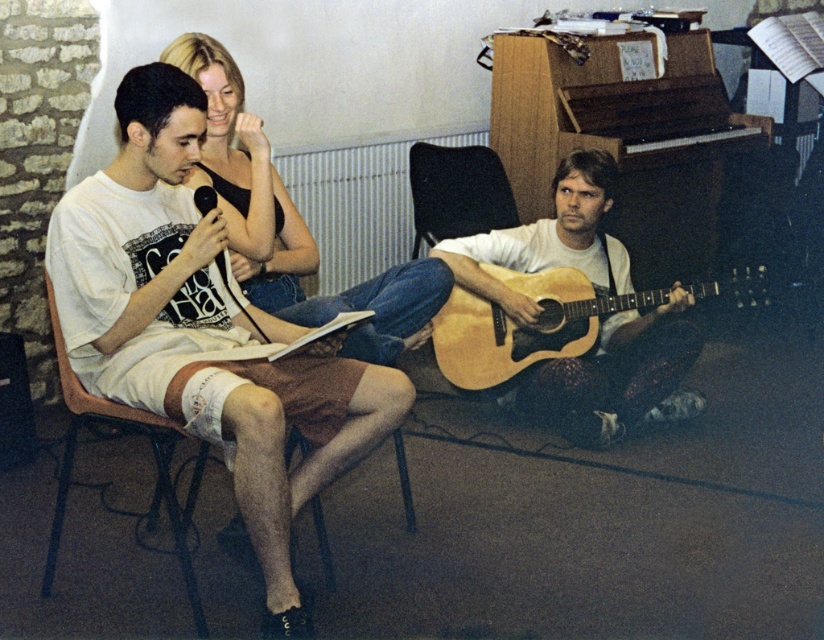
Measure the distance between point (235,310) and camera.

The distance of point (235,310) from camera is 8.58 feet.

Who is higher up, white cotton shorts at center or wooden acoustic guitar at lower right?

wooden acoustic guitar at lower right is higher up.

Is point (176, 124) farther from camera compared to point (542, 241)?

That is False.

The width and height of the screenshot is (824, 640). Find the location of `white cotton shorts at center`. white cotton shorts at center is located at coordinates (204, 330).

Is matte black tank top at upper left behind light brown wooden guitar at lower right?

No.

Who is more forward, (391,268) or (652,296)?

Point (391,268) is in front.

You are a GUI agent. You are given a task and a screenshot of the screen. Output one action in this format:
    pyautogui.click(x=<x>, y=<y>)
    Task: Click on the matte black tank top at upper left
    The image size is (824, 640).
    Given the screenshot: What is the action you would take?
    pyautogui.click(x=343, y=291)

Who is positioned more to the left, wooden acoustic guitar at lower right or matte black tank top at upper left?

matte black tank top at upper left is more to the left.

From the picture: Can you confirm if wooden acoustic guitar at lower right is positioned to the right of matte black tank top at upper left?

Indeed, wooden acoustic guitar at lower right is positioned on the right side of matte black tank top at upper left.

The image size is (824, 640). Identify the location of wooden acoustic guitar at lower right. (618, 378).